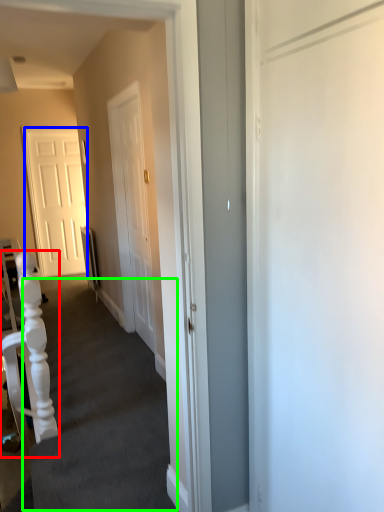
Question: Considering the real-world distances, which object is closest to armchair (highlighted by a red box)? door (highlighted by a blue box) or stairwell (highlighted by a green box).

Choices:
 (A) door
 (B) stairwell

Answer: (B)